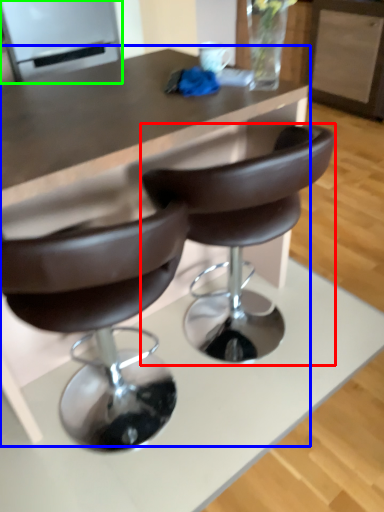
Question: Considering the real-world distances, which object is farthest from chair (highlighted by a red box)? table (highlighted by a blue box) or appliance (highlighted by a green box)?

Choices:
 (A) table
 (B) appliance

Answer: (B)